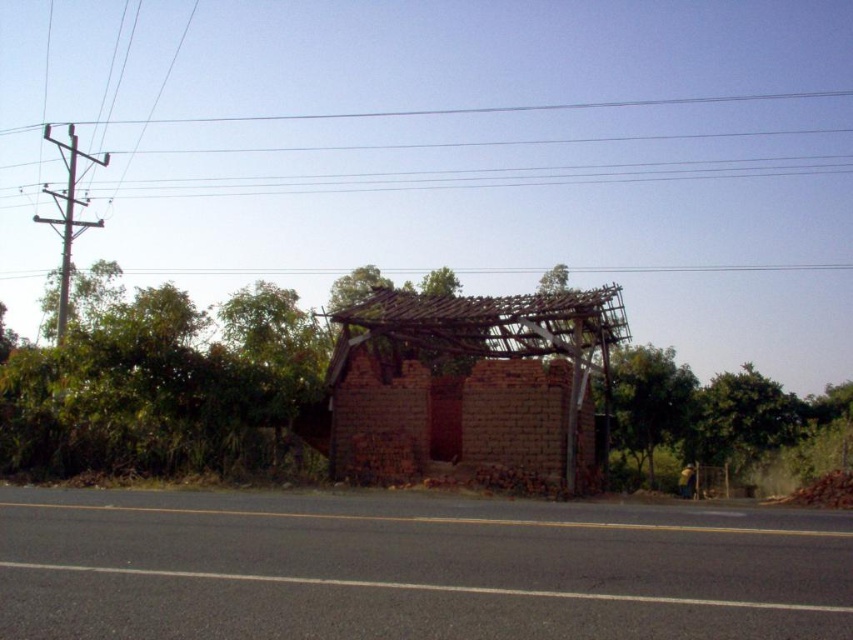
Question: Which of the following is the closest to the observer?

Choices:
 (A) (53, 406)
 (B) (329, 412)
 (C) (635, 390)

Answer: (A)

Question: Where is red brick hut at center located in relation to green leafy tree at left in the image?

Choices:
 (A) left
 (B) right

Answer: (B)

Question: Which of the following is the closest to the observer?

Choices:
 (A) (108, 157)
 (B) (488, 390)

Answer: (B)

Question: Which point appears farthest from the camera in this image?

Choices:
 (A) (659, 374)
 (B) (488, 352)

Answer: (A)

Question: Where is green leafy tree at left located in relation to green leafy tree at center in the image?

Choices:
 (A) below
 (B) above

Answer: (B)

Question: Does green leafy tree at center appear on the right side of brown wooden telegraph pole at left?

Choices:
 (A) no
 (B) yes

Answer: (B)